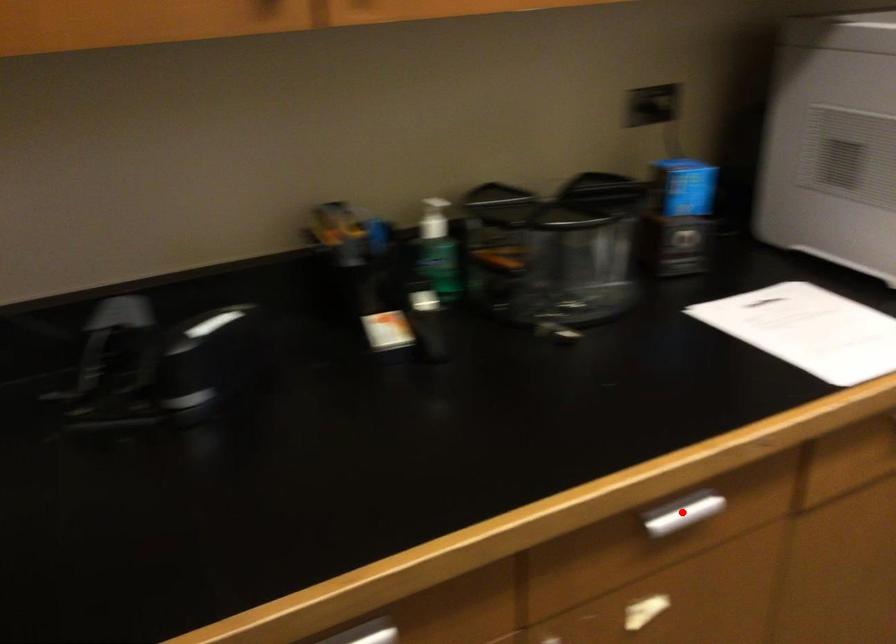
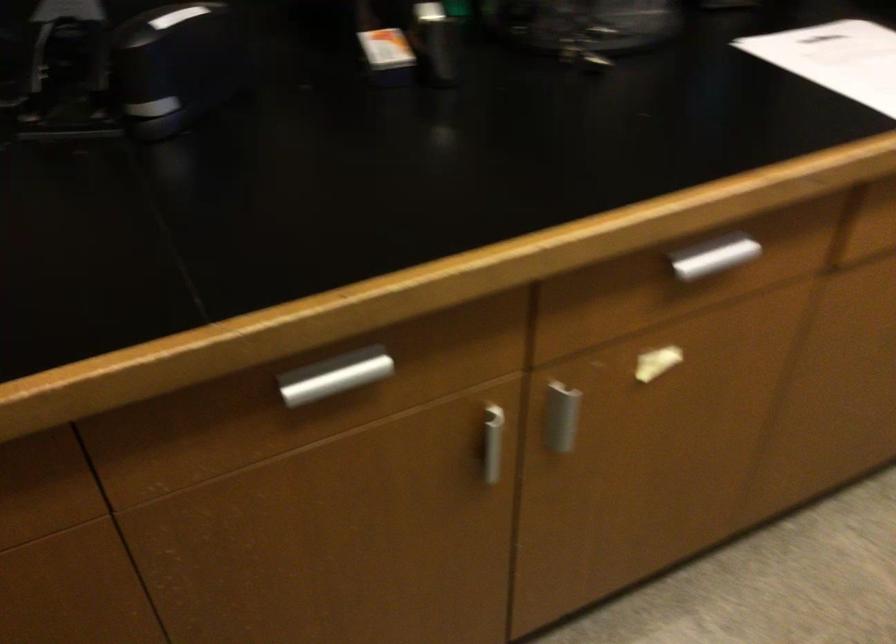
Question: I am providing you with two images of the same scene from different viewpoints. Image1 has a red point marked. In image2, the corresponding 3D location appears at what relative position? Reply with the corresponding letter.

Choices:
 (A) Closer
 (B) Farther

Answer: (A)